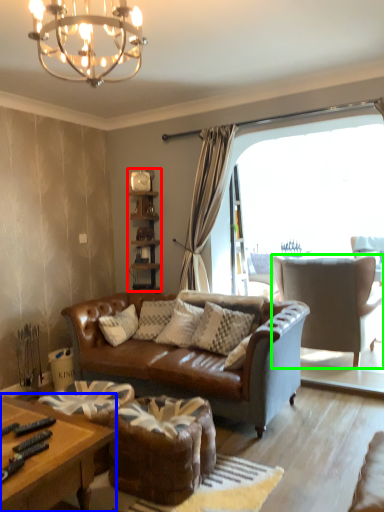
Question: Which object is positioned closest to shelf (highlighted by a red box)? Select from coffee table (highlighted by a blue box) and chair (highlighted by a green box).

Choices:
 (A) coffee table
 (B) chair

Answer: (B)